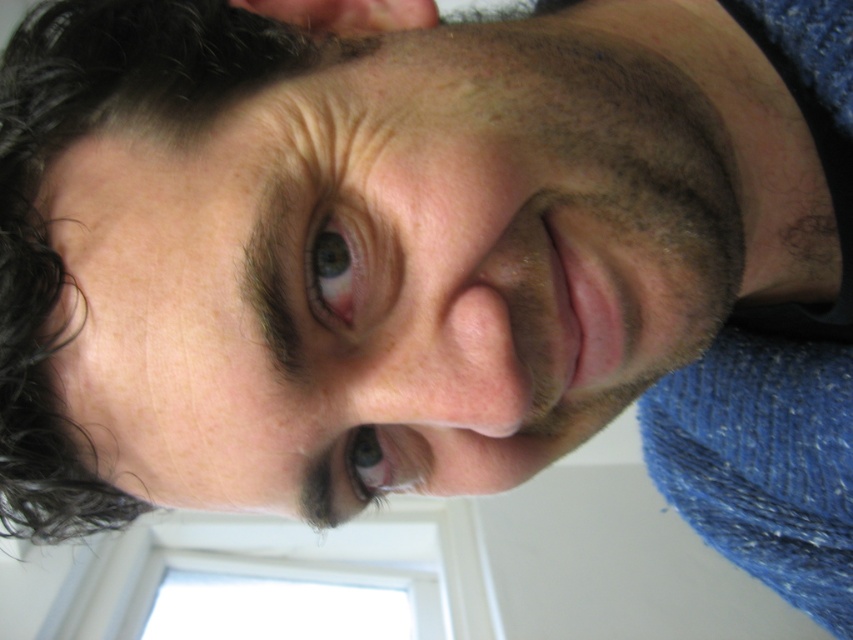
In the scene shown: Does blue glossy eye at upper center have a smaller size compared to brown matte eye at center?

Correct, blue glossy eye at upper center occupies less space than brown matte eye at center.

Who is higher up, blue glossy eye at upper center or brown matte eye at center?

blue glossy eye at upper center is higher up.

Where is `blue glossy eye at upper center`? Image resolution: width=853 pixels, height=640 pixels. blue glossy eye at upper center is located at coordinates (335, 269).

Between point (363, 132) and point (180, 74), which one is positioned behind?

The point (180, 74) is more distant.

Is point (683, 300) closer to camera compared to point (6, 356)?

That is False.

Locate an element on the screen. This screenshot has height=640, width=853. smooth skin face at center is located at coordinates (390, 266).

In the scene shown: Is smooth skin face at center closer to camera compared to blue glossy eye at upper center?

Yes, smooth skin face at center is in front of blue glossy eye at upper center.

This screenshot has height=640, width=853. What do you see at coordinates (390, 266) in the screenshot?
I see `smooth skin face at center` at bounding box center [390, 266].

The width and height of the screenshot is (853, 640). What do you see at coordinates (390, 266) in the screenshot?
I see `smooth skin face at center` at bounding box center [390, 266].

The height and width of the screenshot is (640, 853). I want to click on smooth skin face at center, so click(x=390, y=266).